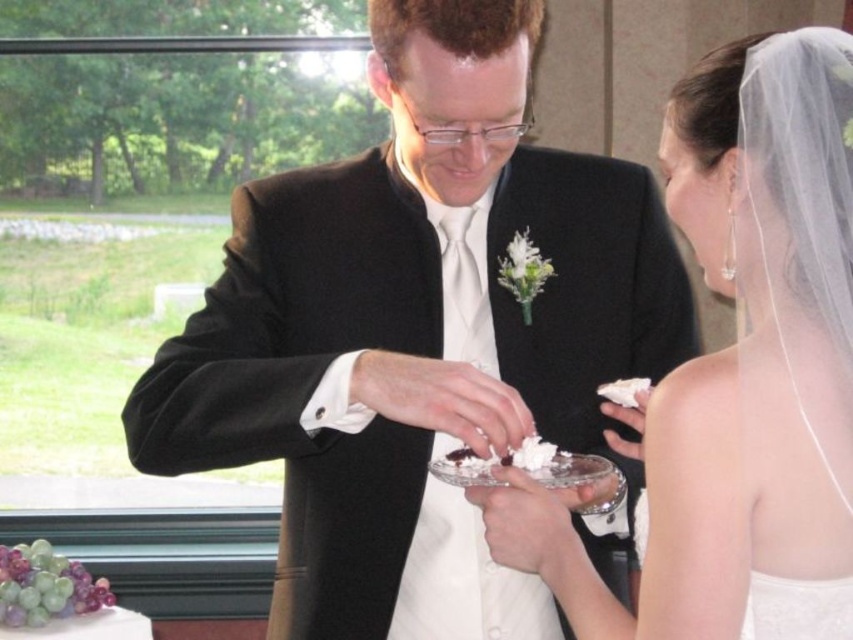
Is black satin suit at center positioned behind white fluffy frosting at center?

No, it is in front of white fluffy frosting at center.

Who is more distant from viewer, (x=427, y=38) or (x=463, y=474)?

The point (x=463, y=474) is behind.

What are the coordinates of `black satin suit at center` in the screenshot? It's located at (416, 333).

Which is more to the right, white satin dress at center or white fluffy frosting at center?

From the viewer's perspective, white satin dress at center appears more on the right side.

The width and height of the screenshot is (853, 640). I want to click on white satin dress at center, so click(737, 372).

In order to click on white satin dress at center in this screenshot , I will do `click(737, 372)`.

Which is below, black satin suit at center or white frosted cake at lower left?

Positioned lower is white frosted cake at lower left.

Can you confirm if black satin suit at center is wider than white frosted cake at lower left?

Yes.

Who is more forward, (x=434, y=397) or (x=57, y=618)?

Point (x=434, y=397) is more forward.

In order to click on black satin suit at center in this screenshot , I will do `click(416, 333)`.